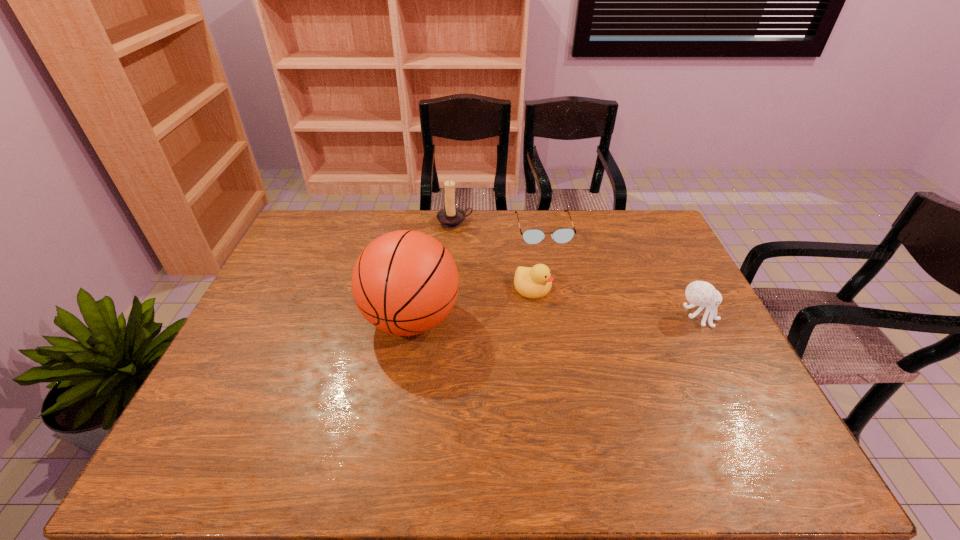
Find the location of a particular element. The image size is (960, 540). vacant space at the near edge of the desktop is located at coordinates (633, 403).

At what (x,y) coordinates should I click in order to perform the action: click on free space at the left edge. Please return your answer as a coordinate pair (x, y). This screenshot has height=540, width=960. Looking at the image, I should click on (264, 332).

This screenshot has width=960, height=540. Find the location of `vacant space at the right edge of the desktop`. vacant space at the right edge of the desktop is located at coordinates (673, 262).

The height and width of the screenshot is (540, 960). I want to click on free area in between the rightmost object and the duckling, so coord(615,302).

Locate an element on the screen. The height and width of the screenshot is (540, 960). empty space between the third shortest object and the candle holder is located at coordinates (576, 270).

Identify the location of free spot between the basketball and the shortest object. This screenshot has width=960, height=540. (477, 274).

Identify the location of vacant area between the shortest object and the second shortest object. This screenshot has height=540, width=960. (538, 258).

This screenshot has height=540, width=960. I want to click on free area in between the duckling and the fourth shortest object, so click(493, 255).

Where is `vacant space in between the shortest object and the second shortest object`? This screenshot has height=540, width=960. vacant space in between the shortest object and the second shortest object is located at coordinates (538, 258).

You are a GUI agent. You are given a task and a screenshot of the screen. Output one action in this format:
    pyautogui.click(x=<x>, y=<y>)
    Task: Click on the vacant point located between the octopus and the fourth shortest object
    The image size is (960, 540).
    Given the screenshot: What is the action you would take?
    pyautogui.click(x=576, y=270)